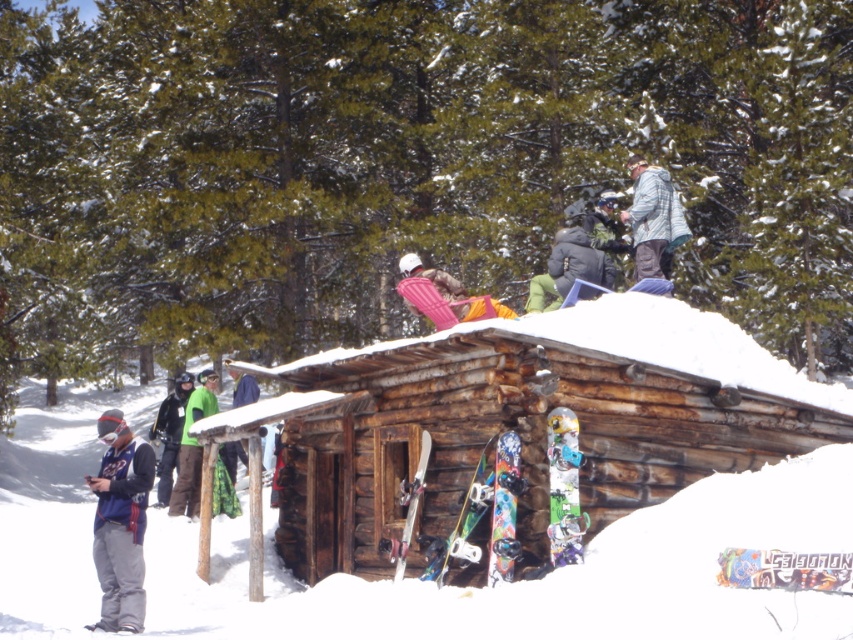
In the scene shown: You are standing at the entrance of the rustic wooden cabin and want to retrieve the multicolored glossy snowboard at lower center. Which direction should you move relative to the multicolored painted snowboard at center?

The multicolored glossy snowboard at lower center is to the right of the multicolored painted snowboard at center, so you should move to the right of the multicolored painted snowboard at center to retrieve it.

You are planning to carry both the multicolored glossy snowboard at lower center and the black matte jacket at left into the cabin. Which item should you pick up first if you want to avoid knocking over the snowboard?

You should pick up the multicolored glossy snowboard at lower center first because it is shorter than the black matte jacket at left, so it is less likely to be knocked over when moving the taller jacket.